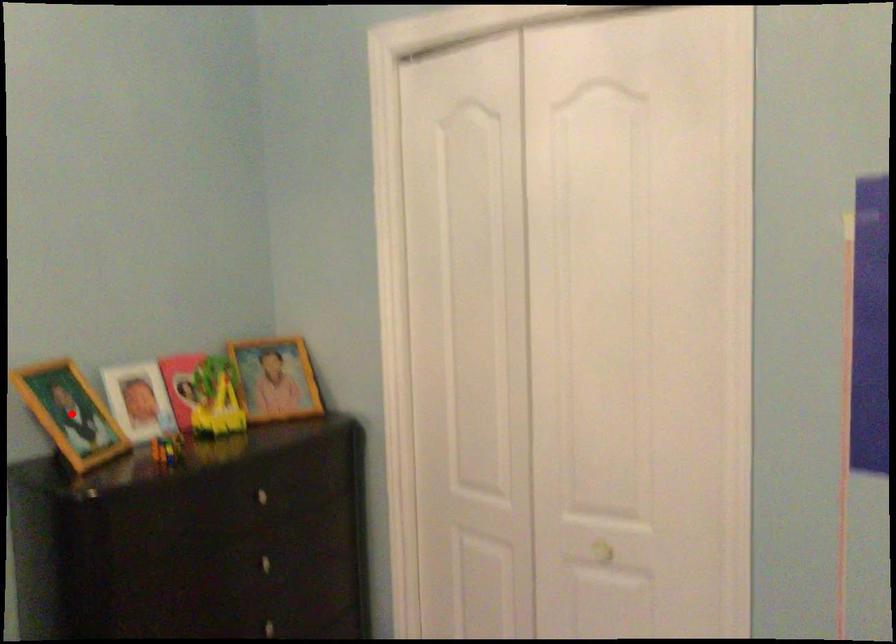
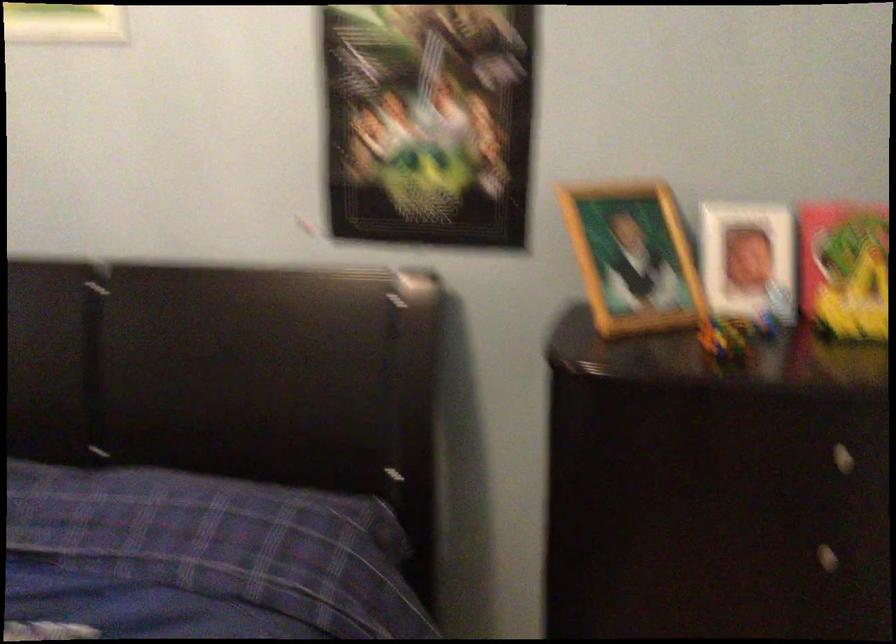
Find the pixel in the second image that matches the highlighted location in the first image.

(633, 258)